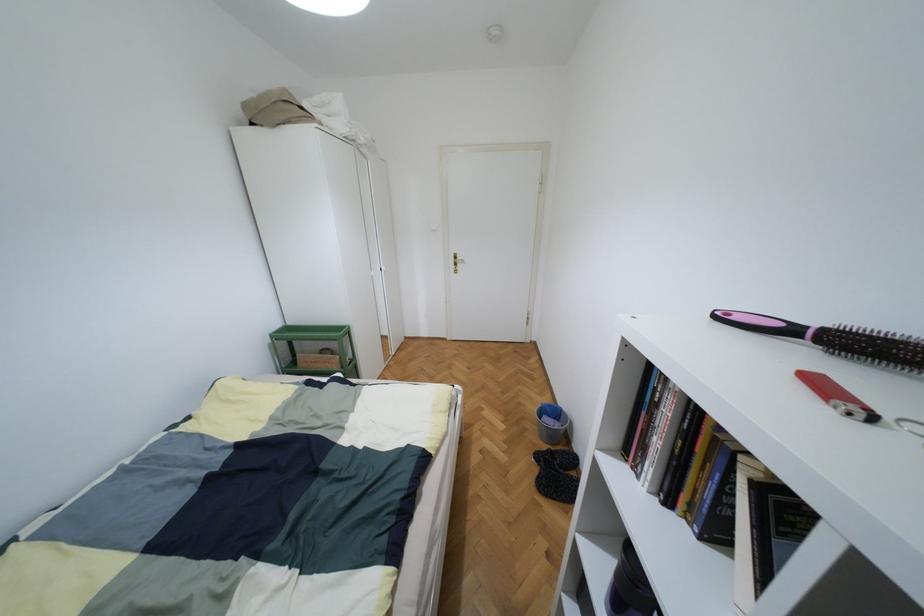
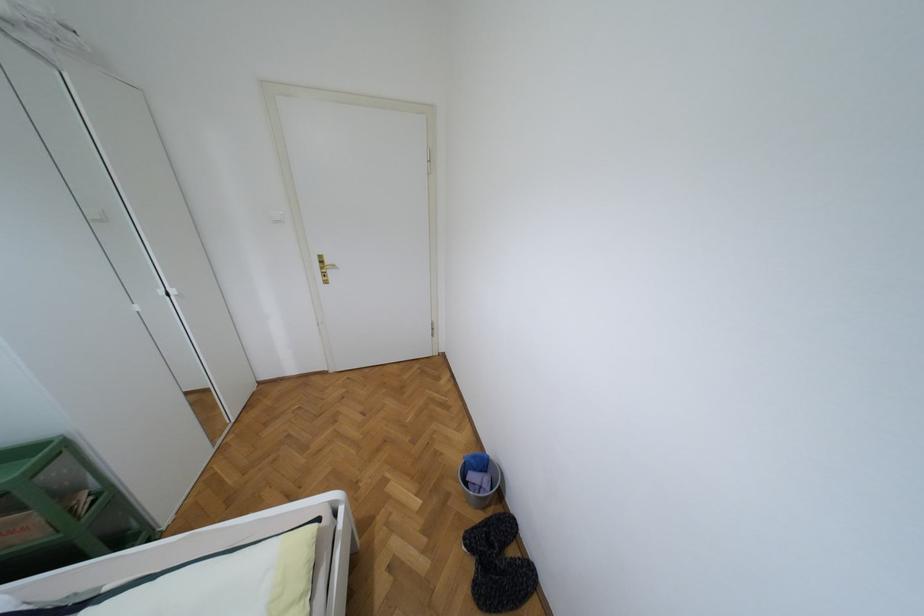
Question: Based on the continuous images, in which direction is the camera rotating? Reply with the corresponding letter.

Choices:
 (A) Left
 (B) Right
 (C) Up
 (D) Down

Answer: (B)